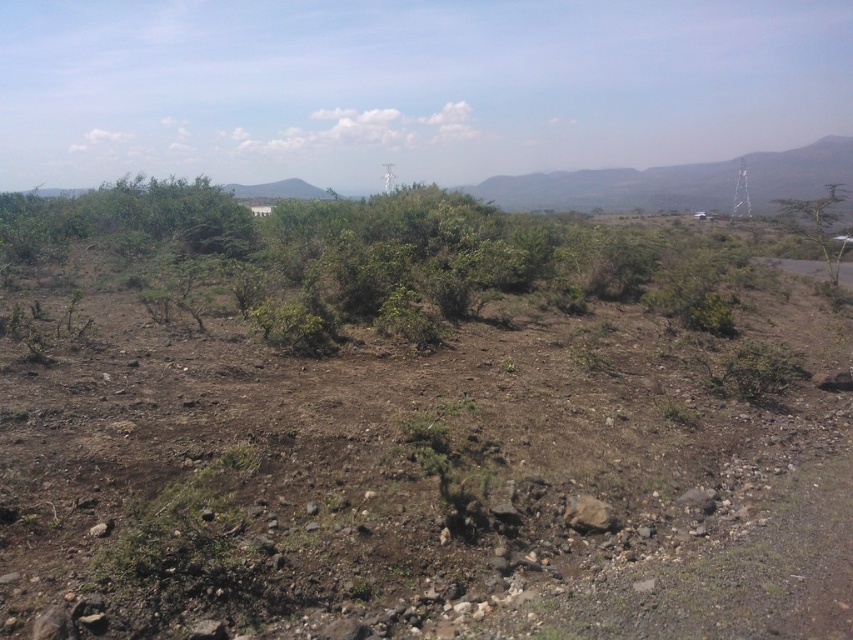
Who is lower down, dull brown dirt at center or green leafy tree at right?

dull brown dirt at center is below.

Who is more forward, (799, 294) or (848, 230)?

Positioned in front is point (799, 294).

Which is in front, point (672, 593) or point (779, 204)?

Point (672, 593) is more forward.

Where is `dull brown dirt at center`? The image size is (853, 640). dull brown dirt at center is located at coordinates (415, 486).